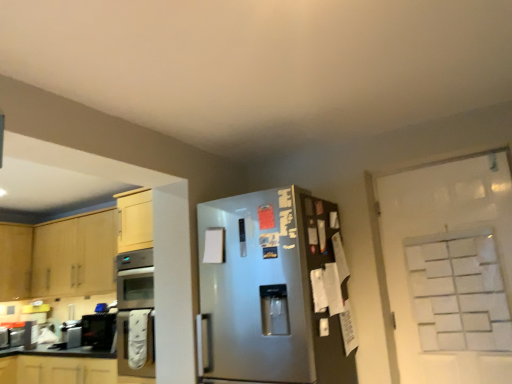
Question: Can you see brushed metal toaster at lower left, which is the 1th appliance in front-to-back order, touching matte white cabinets at lower left, which is counted as the first cabinetry, starting from the bottom?

Choices:
 (A) no
 (B) yes

Answer: (A)

Question: Does brushed metal toaster at lower left, which appears as the second appliance when viewed from the left, appear on the left side of matte white cabinets at lower left, which ranks as the second cabinetry in top-to-bottom order?

Choices:
 (A) yes
 (B) no

Answer: (A)

Question: From a real-world perspective, is brushed metal toaster at lower left, the 2th appliance viewed from the back, over matte white cabinets at lower left, which is counted as the first cabinetry, starting from the bottom?

Choices:
 (A) no
 (B) yes

Answer: (B)

Question: Is brushed metal toaster at lower left, the 2th appliance viewed from the back, to the right of matte white cabinets at lower left, which ranks as the second cabinetry in top-to-bottom order, from the viewer's perspective?

Choices:
 (A) yes
 (B) no

Answer: (B)

Question: Is brushed metal toaster at lower left, which is the 1th appliance in front-to-back order, taller than matte white cabinets at lower left, which ranks as the second cabinetry in top-to-bottom order?

Choices:
 (A) yes
 (B) no

Answer: (B)

Question: Is brushed metal toaster at lower left, which is the first appliance from right to left, taller or shorter than satin silver refrigerator at center?

Choices:
 (A) tall
 (B) short

Answer: (B)

Question: Would you say brushed metal toaster at lower left, which appears as the second appliance when viewed from the left, is inside or outside satin silver refrigerator at center?

Choices:
 (A) inside
 (B) outside

Answer: (B)

Question: In terms of width, does brushed metal toaster at lower left, which appears as the second appliance when viewed from the left, look wider or thinner when compared to satin silver refrigerator at center?

Choices:
 (A) wide
 (B) thin

Answer: (B)

Question: From the image's perspective, relative to satin silver refrigerator at center, is brushed metal toaster at lower left, which is the 1th appliance in front-to-back order, above or below?

Choices:
 (A) above
 (B) below

Answer: (B)

Question: Considering the relative positions of matte white cabinets at lower left, which is counted as the first cabinetry, starting from the bottom, and satin silver refrigerator at center in the image provided, is matte white cabinets at lower left, which is counted as the first cabinetry, starting from the bottom, to the left or to the right of satin silver refrigerator at center?

Choices:
 (A) left
 (B) right

Answer: (A)

Question: Choose the correct answer: Is matte white cabinets at lower left, which ranks as the second cabinetry in top-to-bottom order, inside satin silver refrigerator at center or outside it?

Choices:
 (A) outside
 (B) inside

Answer: (A)

Question: Is point (87, 367) positioned closer to the camera than point (202, 347)?

Choices:
 (A) farther
 (B) closer

Answer: (A)

Question: Is matte white cabinets at lower left, which ranks as the second cabinetry in top-to-bottom order, taller or shorter than satin silver refrigerator at center?

Choices:
 (A) tall
 (B) short

Answer: (B)

Question: Is brushed metal toaster at lower left, which appears as the second appliance when viewed from the right, bigger or smaller than matte white cabinets at lower left, which is counted as the first cabinetry, starting from the bottom?

Choices:
 (A) small
 (B) big

Answer: (A)

Question: In terms of height, does brushed metal toaster at lower left, which appears as the second appliance when viewed from the right, look taller or shorter compared to matte white cabinets at lower left, which ranks as the second cabinetry in top-to-bottom order?

Choices:
 (A) short
 (B) tall

Answer: (A)